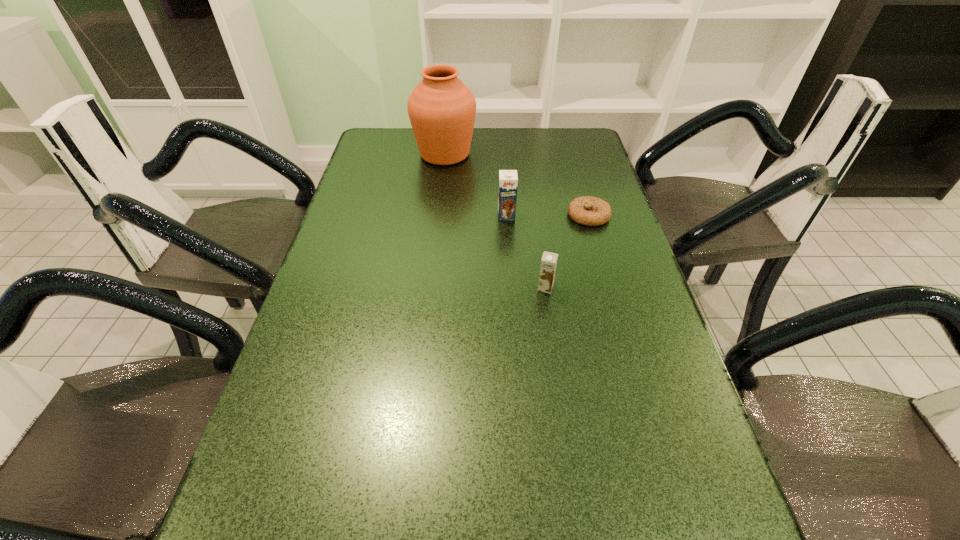
Where is `blank space that satisfies the following two spatial constraints: 1. on the front label of the second object from left to right; 2. on the left side of the second shortest object`? blank space that satisfies the following two spatial constraints: 1. on the front label of the second object from left to right; 2. on the left side of the second shortest object is located at coordinates (512, 287).